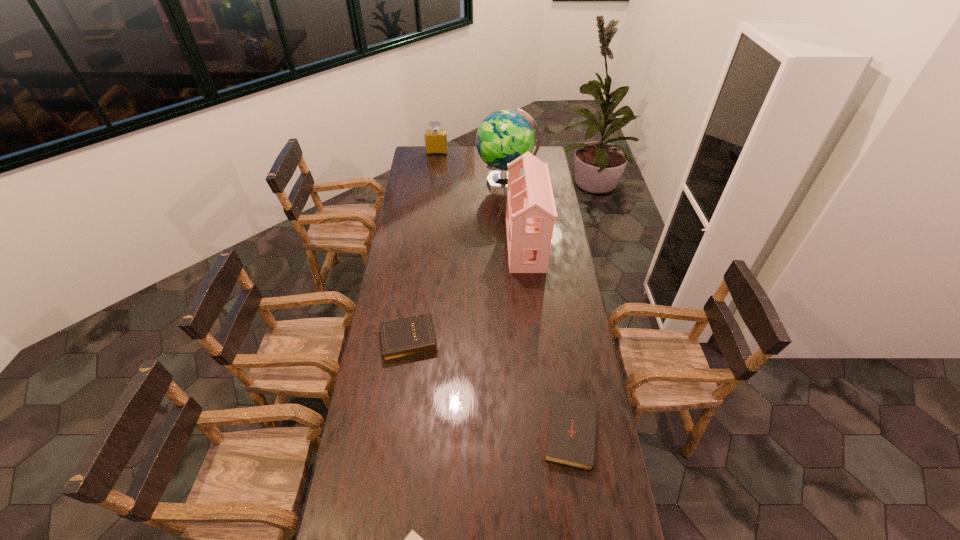
The width and height of the screenshot is (960, 540). I want to click on vacant area that lies between the second farthest object and the second nearest Bible, so click(x=539, y=306).

Locate an element on the screen. The height and width of the screenshot is (540, 960). empty space between the fourth nearest object and the rightmost Bible is located at coordinates (548, 337).

Find the location of a particular element. Image resolution: width=960 pixels, height=540 pixels. free spot between the farthest Bible and the perfume is located at coordinates 421,246.

The width and height of the screenshot is (960, 540). In order to click on free spot between the fourth shortest object and the globe in this screenshot , I will do `click(471, 167)`.

Select which object is the closest to the second farthest Bible. Please provide its 2D coordinates. Your answer should be formatted as a tuple, i.e. [(x, y)], where the tuple contains the x and y coordinates of a point satisfying the conditions above.

[(412, 539)]

Locate which object ranks fifth in proximity to the fifth nearest object. Please provide its 2D coordinates. Your answer should be formatted as a tuple, i.e. [(x, y)], where the tuple contains the x and y coordinates of a point satisfying the conditions above.

[(412, 539)]

Select which Bible is the second closest to the second farthest object. Please provide its 2D coordinates. Your answer should be formatted as a tuple, i.e. [(x, y)], where the tuple contains the x and y coordinates of a point satisfying the conditions above.

[(572, 432)]

Select which Bible is the closest to the nearest Bible. Please provide its 2D coordinates. Your answer should be formatted as a tuple, i.e. [(x, y)], where the tuple contains the x and y coordinates of a point satisfying the conditions above.

[(572, 432)]

The image size is (960, 540). Identify the location of blank space that satisfies the following two spatial constraints: 1. on the front surface of the rightmost Bible; 2. on the left side of the fifth nearest object. (524, 430).

Where is `vacant area that satisfies the following two spatial constraints: 1. on the front surface of the globe; 2. on the right side of the second nearest object`? This screenshot has height=540, width=960. vacant area that satisfies the following two spatial constraints: 1. on the front surface of the globe; 2. on the right side of the second nearest object is located at coordinates (524, 430).